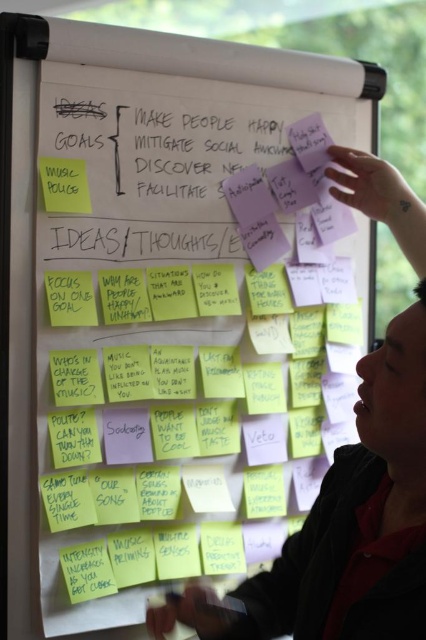
You are a project manager who needs to ensure that the dark skin at upper right and the yellow sticky note at left are visible to all participants in a virtual meeting. Considering the camera angle, which object is closer to the camera?

The dark skin at upper right is closer to the camera than the yellow sticky note at left because the distance between them is 28.99 inches, implying the dark skin is nearer.

Consider the image. You are an observer looking at the whiteboard. You notice the dark skin at upper right and the yellow sticky note at left. Which object is taller?

The dark skin at upper right is taller than the yellow sticky note at left.

What is located at the point with coordinates (x=351, y=477) on the whiteboard?

The point at coordinates (x=351, y=477) is on dark skin at upper right.